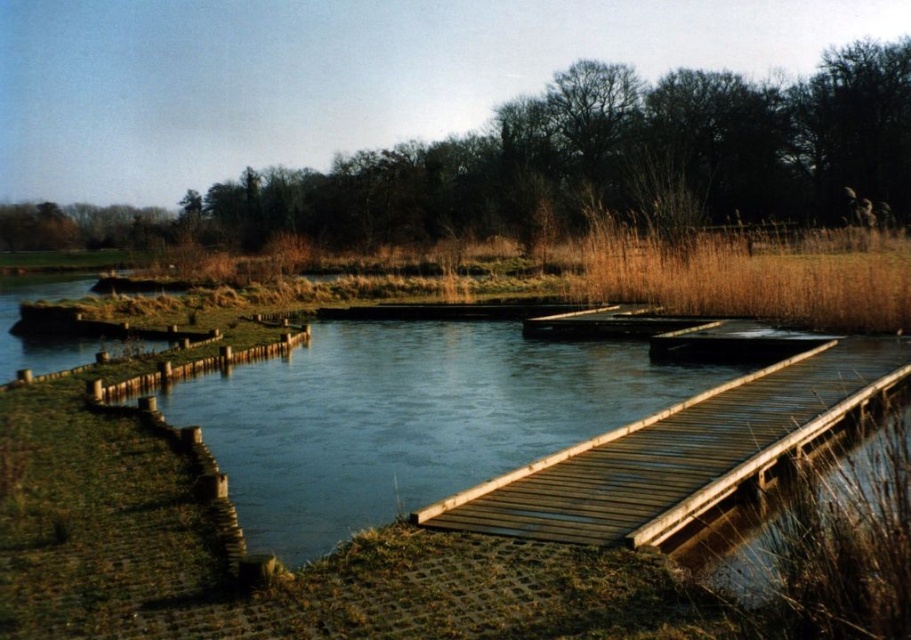
You are standing on the wooden dock at center and want to jump onto the brown grass at upper right. Considering their thickness, will you land safely?

The wooden dock at center is thinner than brown grass at upper right, so the brown grass at upper right is wider and provides a larger landing area, making it safer to jump onto.

You are standing on the wooden dock at center and want to walk towards the brown grass at upper right. Which direction should you move to reach it?

To reach the brown grass at upper right from the wooden dock at center, you should move to the right since the brown grass at upper right is located to the right of the wooden dock at center.